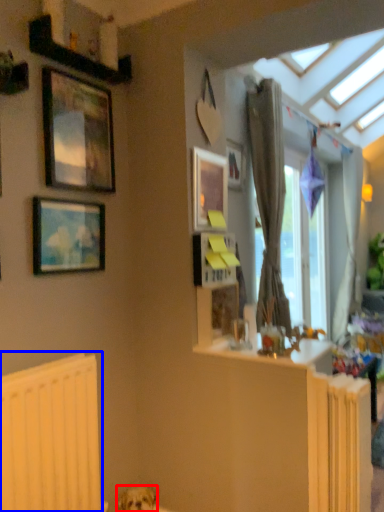
Question: Which object is closer to the camera taking this photo, dog (highlighted by a red box) or radiator (highlighted by a blue box)?

Choices:
 (A) dog
 (B) radiator

Answer: (B)